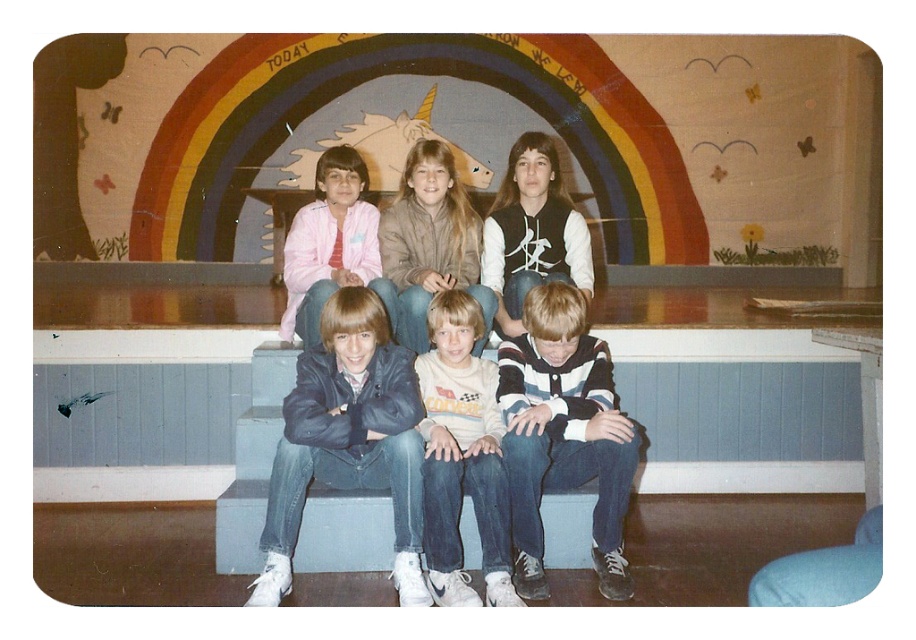
You are a photographer trying to adjust the lighting for a group photo. You notice two key clothing items in the scene. The white cotton shirt at center and the pink fabric jacket at upper left. Which clothing item is positioned higher in the image?

The white cotton shirt at center is much taller than the pink fabric jacket at upper left, so the white cotton shirt at center is positioned higher in the image.

You are standing in front of the mural with the rainbow and unicorn. You notice a white cotton shirt at center. Can you determine its exact position relative to the mural?

Answer: The white cotton shirt at center is located at point coordinates approximately 0.714 on the x axis and 0.505 on the y axis, so it is positioned to the right and slightly below the center of the mural.

Consider the image. You are a photographer setting up for a group photo. You see the blue wood bench at center and the striped cotton shirt at center in the scene. Which object is positioned higher from the ground?

The blue wood bench at center is located above striped cotton shirt at center, so the blue wood bench at center is higher from the ground.